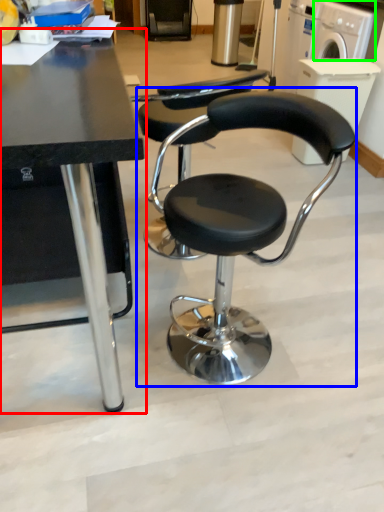
Question: Which object is positioned farthest from table (highlighted by a red box)? Select from chair (highlighted by a blue box) and washing machine (highlighted by a green box).

Choices:
 (A) chair
 (B) washing machine

Answer: (B)